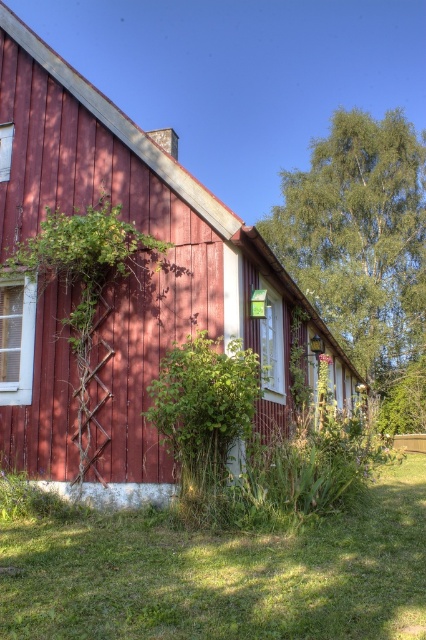
Question: Is green leafy tree at upper right thinner than green leafy bush at lower center?

Choices:
 (A) yes
 (B) no

Answer: (B)

Question: Is wooden hut at center thinner than green leafy bush at lower center?

Choices:
 (A) yes
 (B) no

Answer: (B)

Question: Which point is closer to the camera taking this photo?

Choices:
 (A) [287, 244]
 (B) [250, 586]
 (C) [83, 330]
 (D) [103, 412]

Answer: (B)

Question: Can you confirm if wooden hut at center is smaller than green leafy bush at lower center?

Choices:
 (A) yes
 (B) no

Answer: (B)

Question: Estimate the real-world distances between objects in this image. Which object is closer to the green grass at lower center?

Choices:
 (A) green leafy plant at left
 (B) wooden hut at center
 (C) green leafy tree at upper right
 (D) green leafy bush at lower center

Answer: (D)

Question: Which point appears closest to the camera in this image?

Choices:
 (A) (120, 237)
 (B) (51, 589)
 (C) (207, 417)
 (D) (74, 93)

Answer: (B)